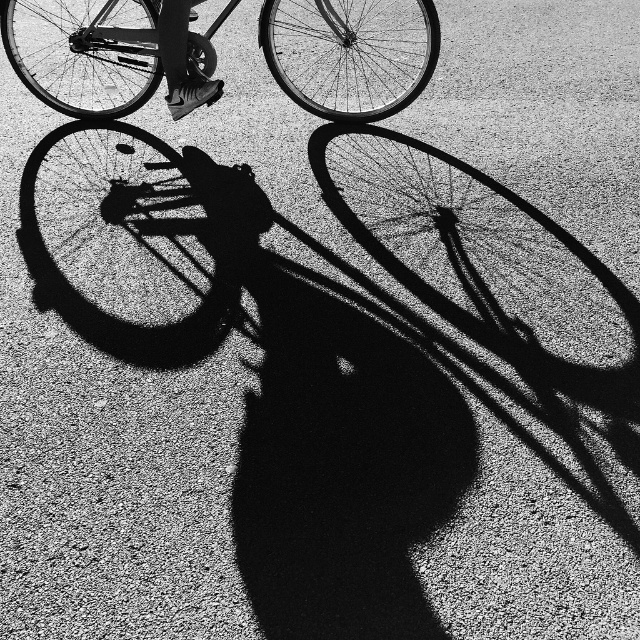
You are standing in front of the metallic silver bicycle at upper center. If you take one step forward, will you be closer than 3 meters to it?

The metallic silver bicycle at upper center is currently 4.02 meters away from you. Taking one step forward would reduce the distance, but unless the step covers more than 1.02 meters, you would still be over 3 meters away. Since an average step is about 0.75 meters, you would remain farther than 3 meters.